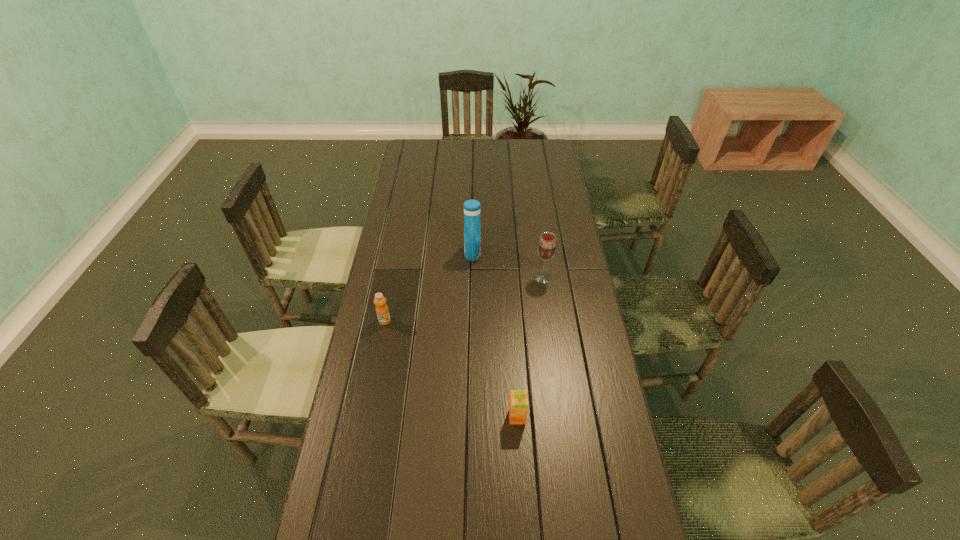
Where is `free space in the image that satisfies the following two spatial constraints: 1. on the front-facing side of the farthest object; 2. on the front label of the left orange juice`? The height and width of the screenshot is (540, 960). free space in the image that satisfies the following two spatial constraints: 1. on the front-facing side of the farthest object; 2. on the front label of the left orange juice is located at coordinates (471, 321).

Identify the location of free space in the image that satisfies the following two spatial constraints: 1. on the front-facing side of the tallest object; 2. on the front label of the leftmost object. (471, 321).

Locate an element on the screen. vacant position in the image that satisfies the following two spatial constraints: 1. on the front-facing side of the detergent; 2. on the right side of the rightmost object is located at coordinates (472, 278).

You are a GUI agent. You are given a task and a screenshot of the screen. Output one action in this format:
    pyautogui.click(x=<x>, y=<y>)
    Task: Click on the free spot that satisfies the following two spatial constraints: 1. on the front-facing side of the third object from left to right; 2. on the left side of the detergent
    This screenshot has height=540, width=960.
    Given the screenshot: What is the action you would take?
    pyautogui.click(x=469, y=417)

Locate an element on the screen. This screenshot has height=540, width=960. vacant space that satisfies the following two spatial constraints: 1. on the back side of the third object from left to right; 2. on the right side of the third shortest object is located at coordinates (509, 278).

At what (x,y) coordinates should I click in order to perform the action: click on blank space that satisfies the following two spatial constraints: 1. on the front-facing side of the tallest object; 2. on the left side of the right orange juice. Please return your answer as a coordinate pair (x, y). The image size is (960, 540). Looking at the image, I should click on (469, 417).

Locate an element on the screen. The width and height of the screenshot is (960, 540). vacant point that satisfies the following two spatial constraints: 1. on the front-facing side of the farthest object; 2. on the back side of the nearest object is located at coordinates (469, 417).

Find the location of a particular element. This screenshot has width=960, height=540. free point that satisfies the following two spatial constraints: 1. on the back side of the wineglass; 2. on the right side of the second object from right to left is located at coordinates (509, 278).